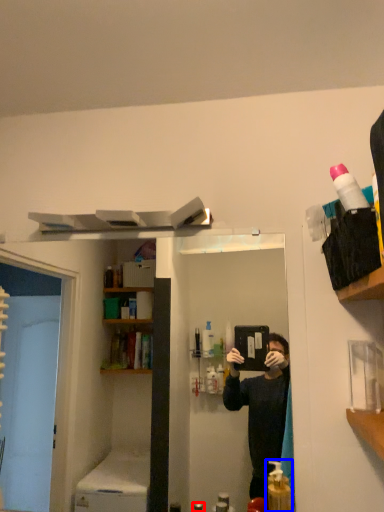
Question: Which object appears closest to the camera in this image, toiletry (highlighted by a red box) or cleaning product (highlighted by a blue box)?

Choices:
 (A) toiletry
 (B) cleaning product

Answer: (B)